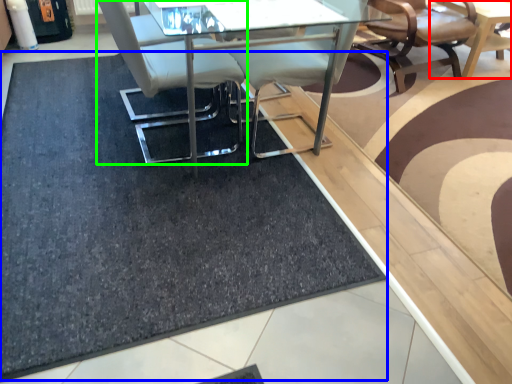
Question: Which object is positioned closest to table (highlighted by a red box)? Select from doormat (highlighted by a blue box) and chair (highlighted by a green box).

Choices:
 (A) doormat
 (B) chair

Answer: (B)